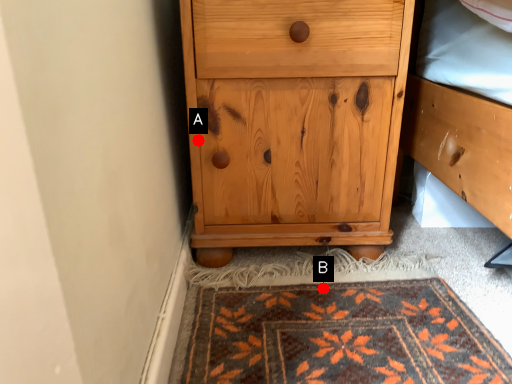
Question: Two points are circled on the image, labeled by A and B beside each circle. Which point appears farthest from the camera in this image?

Choices:
 (A) A is further
 (B) B is further

Answer: (B)